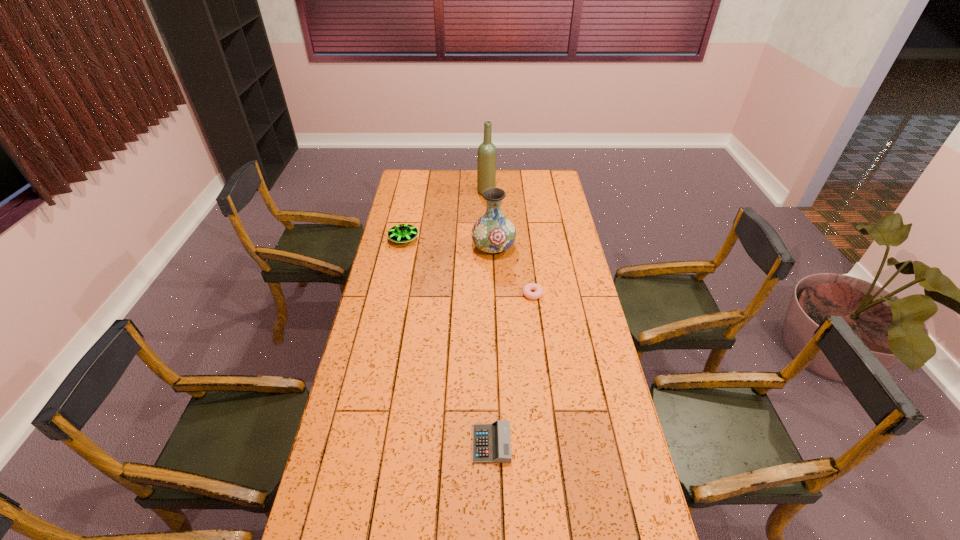
Identify the location of vacant space located 0.350m on the front of the saucer. (390, 304).

This screenshot has width=960, height=540. Identify the location of vacant space located on the front of the calculator. (493, 532).

Where is `free point located on the front of the fourth farthest object`? free point located on the front of the fourth farthest object is located at coordinates (541, 368).

Find the location of a particular element. object at the far edge is located at coordinates (486, 163).

You are a GUI agent. You are given a task and a screenshot of the screen. Output one action in this format:
    pyautogui.click(x=<x>, y=<y>)
    Task: Click on the object located at the left edge
    
    Given the screenshot: What is the action you would take?
    pyautogui.click(x=402, y=233)

In the image, there is a desktop. Where is `vacant space at the left edge`? vacant space at the left edge is located at coordinates (380, 256).

Image resolution: width=960 pixels, height=540 pixels. Identify the location of vacant space at the right edge. (561, 307).

Find the location of a particular element. The image size is (960, 540). free space at the far right corner is located at coordinates (549, 176).

Find the location of `free space between the leftmost object and the doughnut`. free space between the leftmost object and the doughnut is located at coordinates (468, 267).

At what (x,y) coordinates should I click in order to perform the action: click on free point between the calculator and the doughnut. Please return your answer as a coordinate pair (x, y). The image size is (960, 540). Looking at the image, I should click on (512, 369).